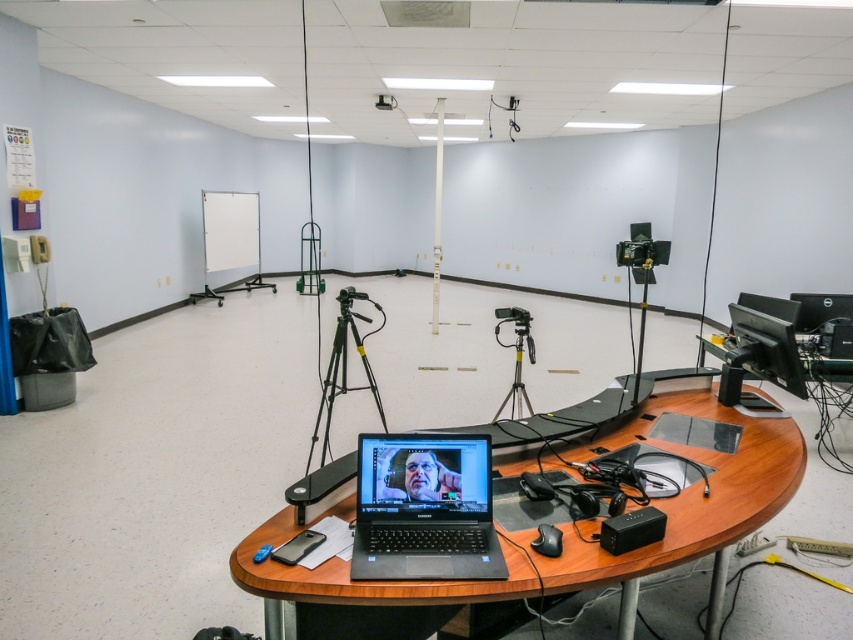
Which is more to the right, black matte laptop at center or silver metallic tripod at center?

From the viewer's perspective, silver metallic tripod at center appears more on the right side.

Which is behind, point (460, 557) or point (514, 410)?

Positioned behind is point (514, 410).

You are a GUI agent. You are given a task and a screenshot of the screen. Output one action in this format:
    pyautogui.click(x=<x>, y=<y>)
    Task: Click on the black matte laptop at center
    The height and width of the screenshot is (640, 853).
    Given the screenshot: What is the action you would take?
    pyautogui.click(x=424, y=508)

Find the location of a particular element. black matte laptop at center is located at coordinates (424, 508).

Can you confirm if black matte tripod at center is taller than black plastic projector at upper center?

Correct, black matte tripod at center is much taller as black plastic projector at upper center.

How distant is black matte tripod at center from black plastic projector at upper center?

black matte tripod at center and black plastic projector at upper center are 3.42 meters apart.

This screenshot has width=853, height=640. Identify the location of black matte tripod at center. (344, 368).

Which is behind, point (669, 500) or point (503, 564)?

The point (669, 500) is behind.

Is wooden round table at center thinner than black matte laptop at center?

No, wooden round table at center is not thinner than black matte laptop at center.

Does point (231, 556) come farther from viewer compared to point (465, 573)?

Yes, it is behind point (465, 573).

At what (x,y) coordinates should I click in order to perform the action: click on wooden round table at center. Please return your answer as a coordinate pair (x, y). Looking at the image, I should click on (573, 531).